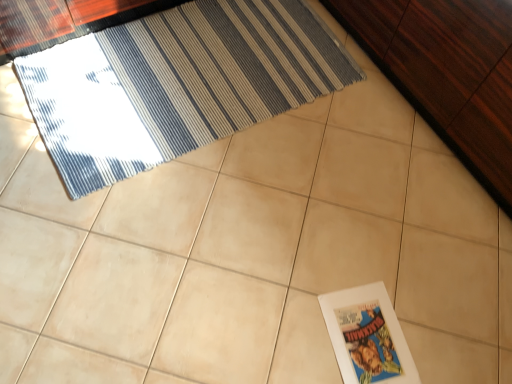
You are a GUI agent. You are given a task and a screenshot of the screen. Output one action in this format:
    pyautogui.click(x=<x>, y=<y>)
    Task: Click on the vacant area situated below white paper at lower right (from a real-world perspective)
    Image resolution: width=512 pixels, height=384 pixels.
    Given the screenshot: What is the action you would take?
    pyautogui.click(x=371, y=340)